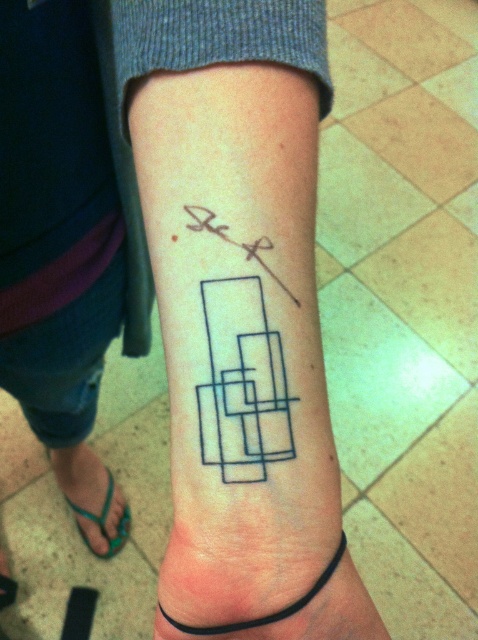
You are a tattoo artist trying to locate the black ink tattoo at center on a client. The client is standing with their arm extended forward. Using the coordinate system where the center of the image is point 0.5, 0.5, can you confirm if the point (239, 314) is the correct location for the black ink tattoo at center?

Yes, the black ink tattoo at center is represented by point (239, 314), so this is the correct location.

You are organizing a craft kit and need to place the black rubber band at lower center and the black ink square at upper center into a storage box. If the box has two compartments with height limits, the lower compartment can only hold items up to 2 cm tall and the upper compartment can hold up to 3 cm. Based on their heights, which object should go into which compartment?

The black rubber band at lower center has a greater height than the black ink square at upper center. Since the lower compartment can hold up to 2 cm and the upper compartment up to 3 cm, the black rubber band at lower center must go into the upper compartment because its height exceeds 2 cm. The black ink square at upper center can fit into the lower compartment as its height is under 2 cm.